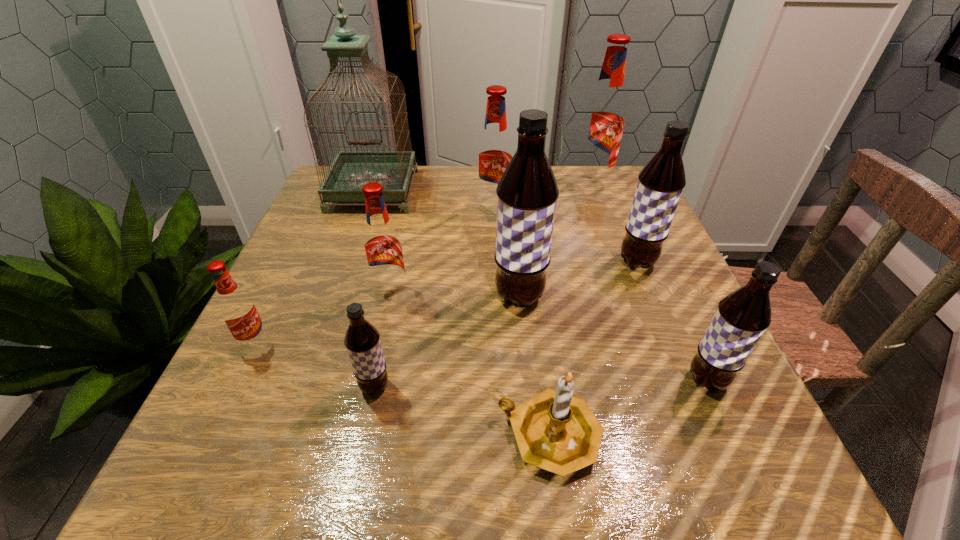
This screenshot has width=960, height=540. Identify the location of birdcage that is at the left edge. (350, 170).

The height and width of the screenshot is (540, 960). In order to click on root beer present at the left edge in this screenshot , I will do `click(236, 307)`.

Find the location of a particular element. object that is at the far left corner is located at coordinates (350, 170).

Locate an element on the screen. object at the far right corner is located at coordinates 603,122.

The image size is (960, 540). What are the coordinates of `free region at the far edge of the desktop` in the screenshot? It's located at (465, 193).

In the image, there is a desktop. Where is `vacant space at the near edge`? This screenshot has width=960, height=540. vacant space at the near edge is located at coordinates (548, 494).

You are a GUI agent. You are given a task and a screenshot of the screen. Output one action in this format:
    pyautogui.click(x=<x>, y=<y>)
    Task: Click on the free spot at the left edge of the desktop
    
    Given the screenshot: What is the action you would take?
    pyautogui.click(x=323, y=270)

Where is `blank area at the right edge`? This screenshot has width=960, height=540. blank area at the right edge is located at coordinates (602, 241).

This screenshot has height=540, width=960. Find the location of `free space at the near left corner`. free space at the near left corner is located at coordinates pos(167,481).

Where is `empty space that is in between the smallest brown root beer and the third biggest brown root beer`? Image resolution: width=960 pixels, height=540 pixels. empty space that is in between the smallest brown root beer and the third biggest brown root beer is located at coordinates (540, 383).